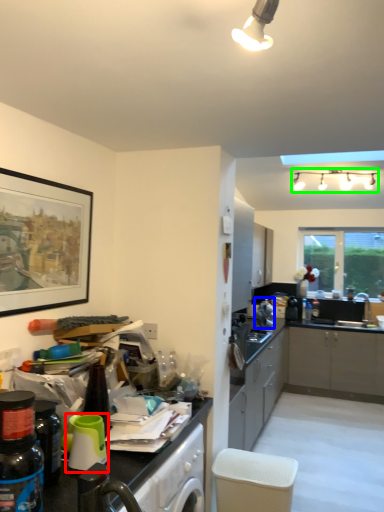
Question: Considering the real-world distances, which object is closest to appliance (highlighted by a red box)? appliance (highlighted by a blue box) or light fixture (highlighted by a green box).

Choices:
 (A) appliance
 (B) light fixture

Answer: (A)